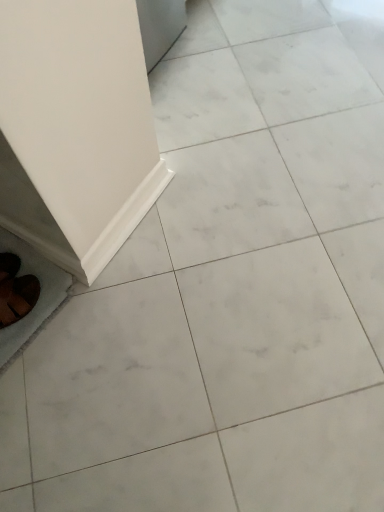
At what (x,y) coordinates should I click in order to perform the action: click on free space in front of white glossy baseboard at lower left, which appears as the 1th ceramic tile when viewed from the right. Please return your answer as a coordinate pair (x, y). This screenshot has height=512, width=384. Looking at the image, I should click on pyautogui.click(x=141, y=294).